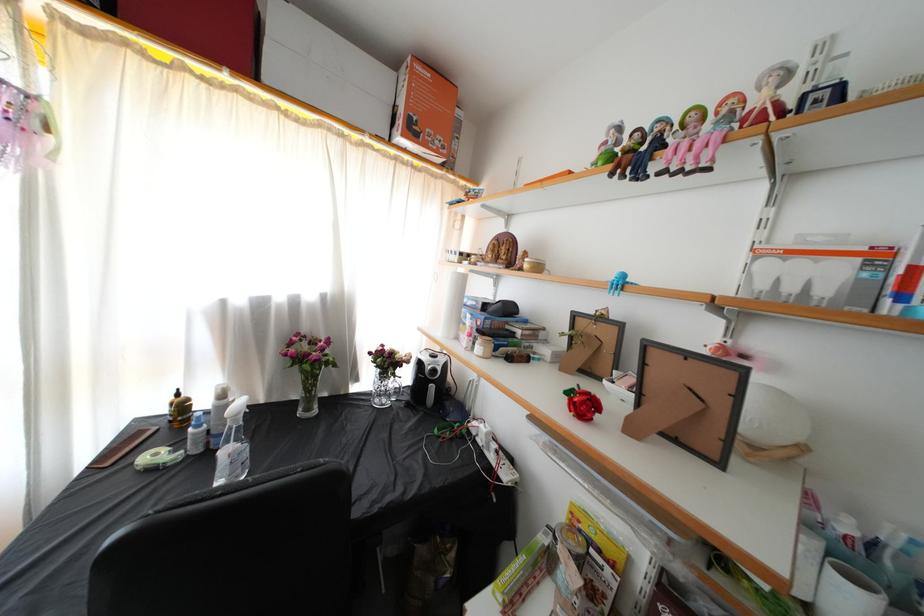
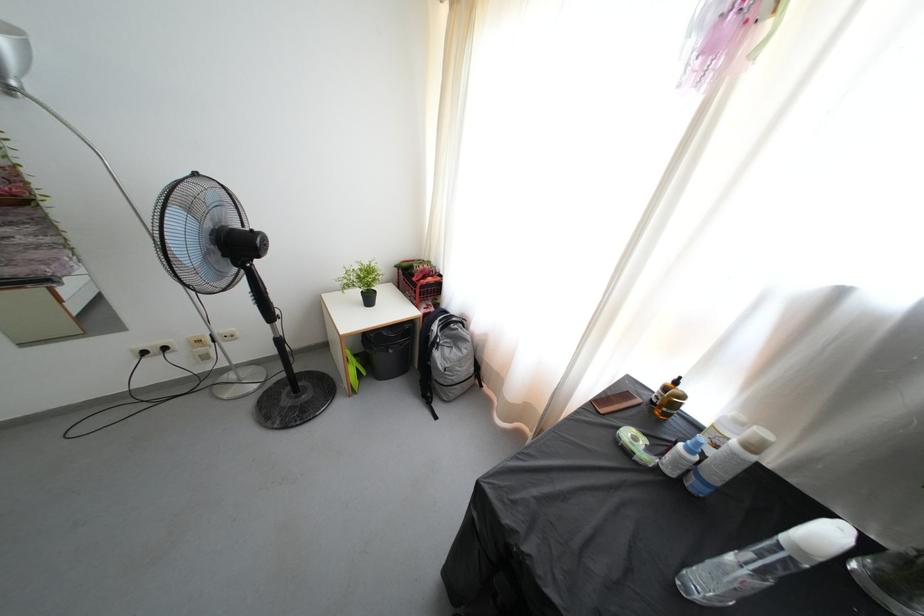
Locate, in the second image, the point that corresponds to (156,475) in the first image.

(631, 458)